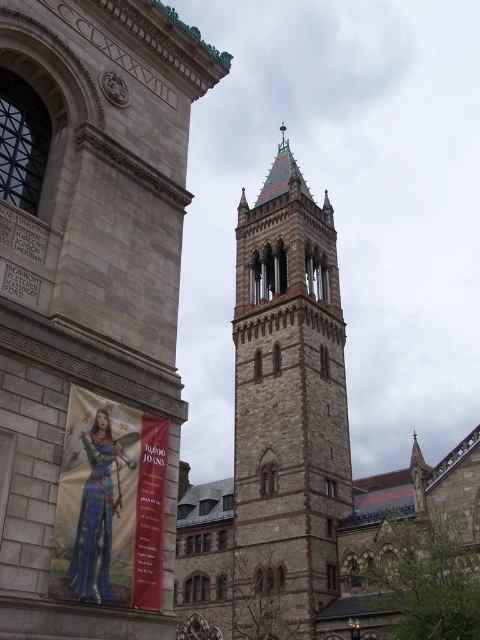
Question: Does brown stone tower at upper center appear under brown stone tower at center?

Choices:
 (A) no
 (B) yes

Answer: (B)

Question: Does brown stone tower at upper center have a larger size compared to matte gold banner at lower left?

Choices:
 (A) yes
 (B) no

Answer: (A)

Question: Is brown stone tower at upper center positioned behind brown stone tower at center?

Choices:
 (A) no
 (B) yes

Answer: (A)

Question: Which of the following is the farthest from the observer?

Choices:
 (A) brown stone tower at upper center
 (B) matte gold banner at lower left
 (C) brown stone tower at center

Answer: (C)

Question: Which point is closer to the camera?

Choices:
 (A) (98, 541)
 (B) (146, 52)
 (C) (254, 218)

Answer: (A)

Question: Which object is the closest to the brown stone tower at center?

Choices:
 (A) matte gold banner at lower left
 (B) brown stone tower at upper center

Answer: (B)